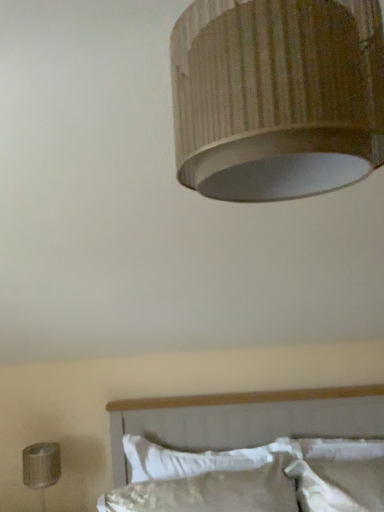
Question: From a real-world perspective, is white soft pillow at lower center physically above wooden textured lampshade at upper center, which appears as the 1th lamp when viewed from the right?

Choices:
 (A) no
 (B) yes

Answer: (A)

Question: Is white soft pillow at lower center turned away from wooden textured lampshade at upper center, which appears as the 1th lamp when viewed from the right?

Choices:
 (A) no
 (B) yes

Answer: (A)

Question: Considering the relative sizes of white soft pillow at lower center and wooden textured lampshade at upper center, the first lamp viewed from the front, in the image provided, is white soft pillow at lower center bigger than wooden textured lampshade at upper center, the first lamp viewed from the front,?

Choices:
 (A) no
 (B) yes

Answer: (A)

Question: Can you confirm if white soft pillow at lower center is taller than wooden textured lampshade at upper center, the 1th lamp positioned from the top?

Choices:
 (A) yes
 (B) no

Answer: (B)

Question: Can wooden textured lampshade at upper center, acting as the 2th lamp starting from the left, be found inside white soft pillow at lower center?

Choices:
 (A) no
 (B) yes

Answer: (A)

Question: From the image's perspective, is white soft pillow at lower center above wooden textured lampshade at upper center, which appears as the 1th lamp when viewed from the right?

Choices:
 (A) no
 (B) yes

Answer: (A)

Question: From the image's perspective, would you say white textured bed at lower center is positioned over metallic silver lamp at lower left, the first lamp in the bottom-to-top sequence?

Choices:
 (A) yes
 (B) no

Answer: (A)

Question: Considering the relative positions of white textured bed at lower center and metallic silver lamp at lower left, the first lamp in the bottom-to-top sequence, in the image provided, is white textured bed at lower center to the right of metallic silver lamp at lower left, the first lamp in the bottom-to-top sequence, from the viewer's perspective?

Choices:
 (A) no
 (B) yes

Answer: (B)

Question: Is white textured bed at lower center directly adjacent to metallic silver lamp at lower left, the second lamp in the top-to-bottom sequence?

Choices:
 (A) no
 (B) yes

Answer: (A)

Question: Considering the relative sizes of white textured bed at lower center and metallic silver lamp at lower left, arranged as the first lamp when viewed from the back, in the image provided, is white textured bed at lower center bigger than metallic silver lamp at lower left, arranged as the first lamp when viewed from the back,?

Choices:
 (A) no
 (B) yes

Answer: (B)

Question: Is white textured bed at lower center facing away from metallic silver lamp at lower left, the first lamp in the bottom-to-top sequence?

Choices:
 (A) no
 (B) yes

Answer: (A)

Question: Would you say white textured bed at lower center contains metallic silver lamp at lower left, the second lamp in the top-to-bottom sequence?

Choices:
 (A) no
 (B) yes

Answer: (A)

Question: Does white textured bed at lower center turn towards white soft pillow at lower center?

Choices:
 (A) yes
 (B) no

Answer: (A)